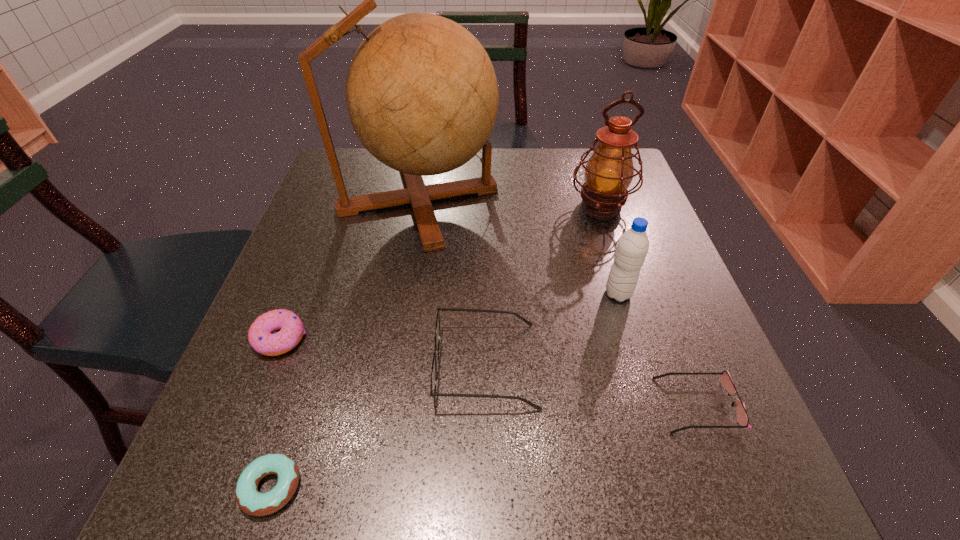
The width and height of the screenshot is (960, 540). I want to click on free region at the far edge of the desktop, so click(470, 161).

I want to click on vacant space at the near edge of the desktop, so click(x=493, y=499).

The image size is (960, 540). In order to click on free region at the left edge of the desktop in this screenshot , I will do `click(240, 410)`.

Find the location of a particular element. vacant space at the right edge of the desktop is located at coordinates (685, 432).

Identify the location of vacant space at the near left corner. The image size is (960, 540). (256, 457).

The image size is (960, 540). In order to click on vacant space at the near right corner of the desktop in this screenshot , I will do `click(706, 477)`.

The height and width of the screenshot is (540, 960). Identify the location of empty space that is in between the sixth tallest object and the globe. (558, 302).

Find the location of a particular element. vacant area that lies between the spectacles and the farther doughnut is located at coordinates (383, 352).

This screenshot has width=960, height=540. What are the coordinates of `vacant region between the oil lamp and the taller doughnut` in the screenshot? It's located at (441, 272).

The width and height of the screenshot is (960, 540). I want to click on vacant space in between the second tallest object and the globe, so click(x=510, y=203).